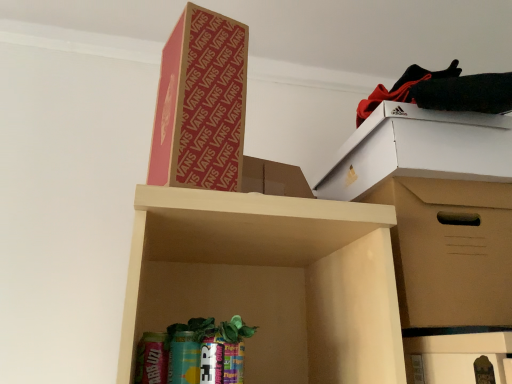
Question: Based on their sizes in the image, would you say cardboard box at upper center, the 1th cardboard box from the left, is bigger or smaller than brown cardboard box at right, the 2th cardboard box in the left-to-right sequence?

Choices:
 (A) small
 (B) big

Answer: (A)

Question: Is point (164, 117) closer or farther from the camera than point (480, 223)?

Choices:
 (A) farther
 (B) closer

Answer: (B)

Question: Based on their relative distances, which object is nearer to the black fabric at upper right?

Choices:
 (A) brown cardboard box at right, arranged as the first cardboard box when viewed from the right
 (B) cardboard box at upper center, which is the 2th cardboard box in bottom-to-top order

Answer: (A)

Question: Considering the real-world distances, which object is farthest from the cardboard box at upper center, the second cardboard box when ordered from right to left?

Choices:
 (A) black fabric at upper right
 (B) brown cardboard box at right, the first cardboard box when ordered from bottom to top

Answer: (B)